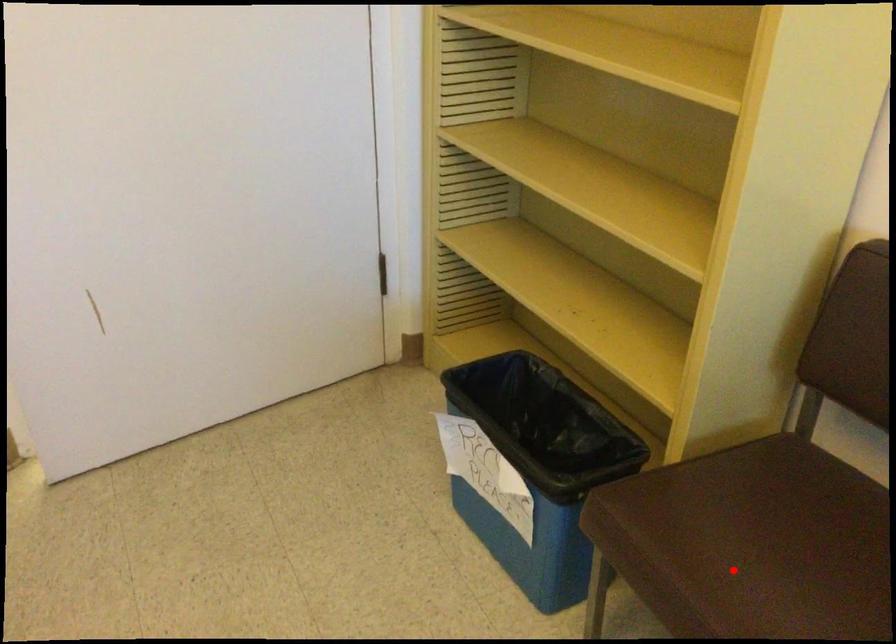
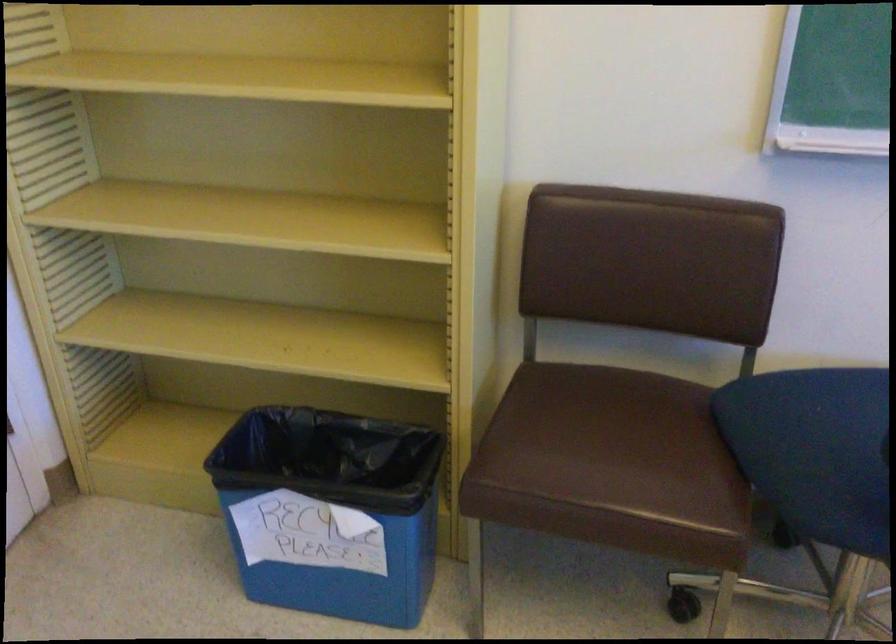
The point at the highlighted location is marked in the first image. Where is the corresponding point in the second image?

(610, 464)